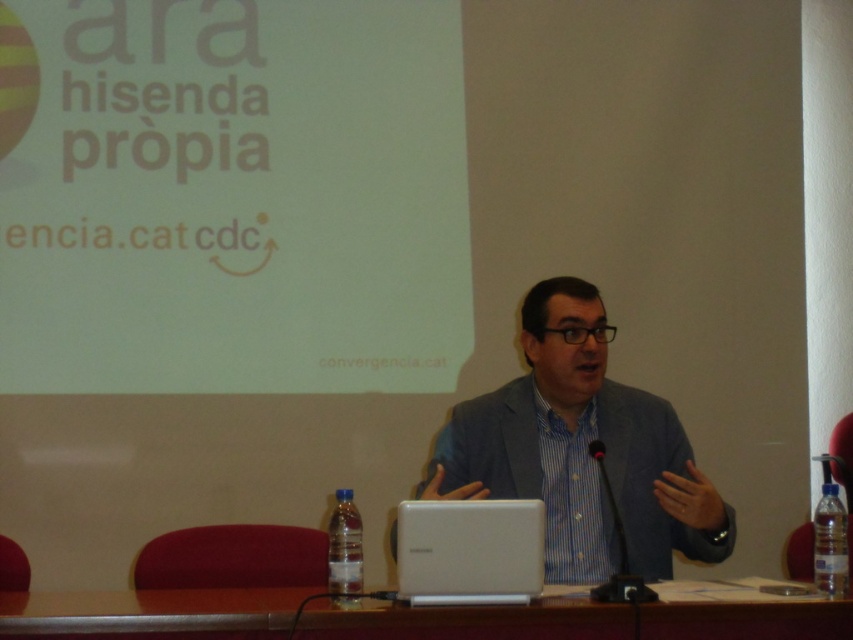
Who is positioned more to the right, wooden table at center or white plastic laptop at center?

white plastic laptop at center

How far apart are wooden table at center and white plastic laptop at center?

They are 7.12 inches apart.

What do you see at coordinates (149, 612) in the screenshot?
I see `wooden table at center` at bounding box center [149, 612].

You are a GUI agent. You are given a task and a screenshot of the screen. Output one action in this format:
    pyautogui.click(x=<x>, y=<y>)
    Task: Click on the wooden table at center
    
    Given the screenshot: What is the action you would take?
    pyautogui.click(x=149, y=612)

Consider the image. Is white matte projection screen at upper center below blue striped shirt at center?

Actually, white matte projection screen at upper center is above blue striped shirt at center.

Measure the distance between white matte projection screen at upper center and camera.

A distance of 3.17 meters exists between white matte projection screen at upper center and camera.

Where is `white matte projection screen at upper center`? This screenshot has width=853, height=640. white matte projection screen at upper center is located at coordinates (236, 198).

Which is more to the right, blue striped shirt at center or black plastic microphone at center?

black plastic microphone at center is more to the right.

Does blue striped shirt at center come behind black plastic microphone at center?

That is True.

Who is more distant from viewer, (703, 490) or (602, 460)?

The point (602, 460) is behind.

Locate an element on the screen. Image resolution: width=853 pixels, height=640 pixels. blue striped shirt at center is located at coordinates [x=581, y=449].